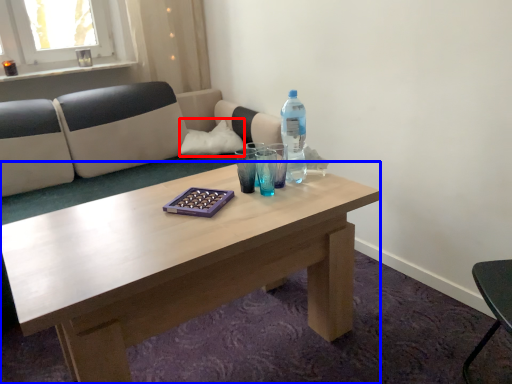
Question: Which object appears closest to the camera in this image, pillow (highlighted by a red box) or coffee table (highlighted by a blue box)?

Choices:
 (A) pillow
 (B) coffee table

Answer: (B)